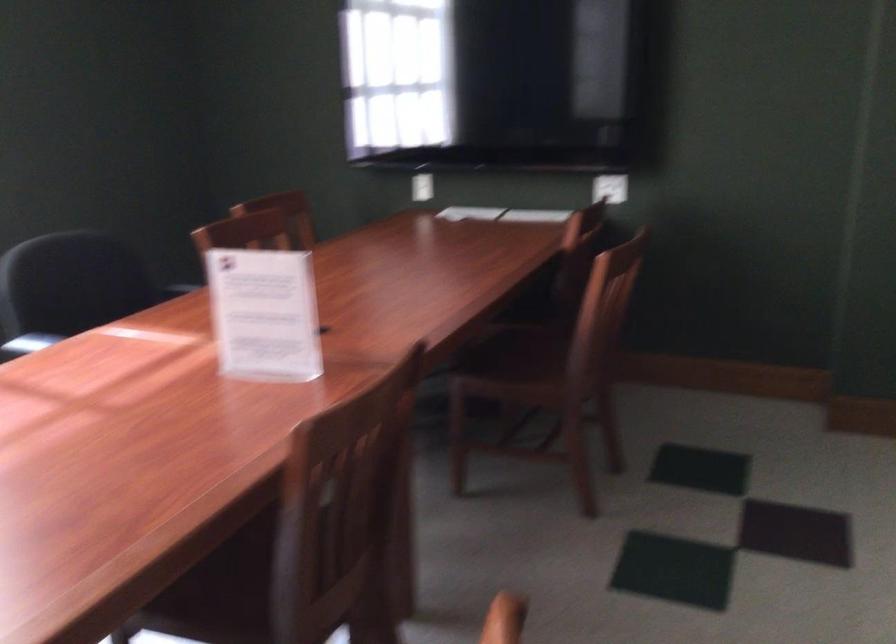
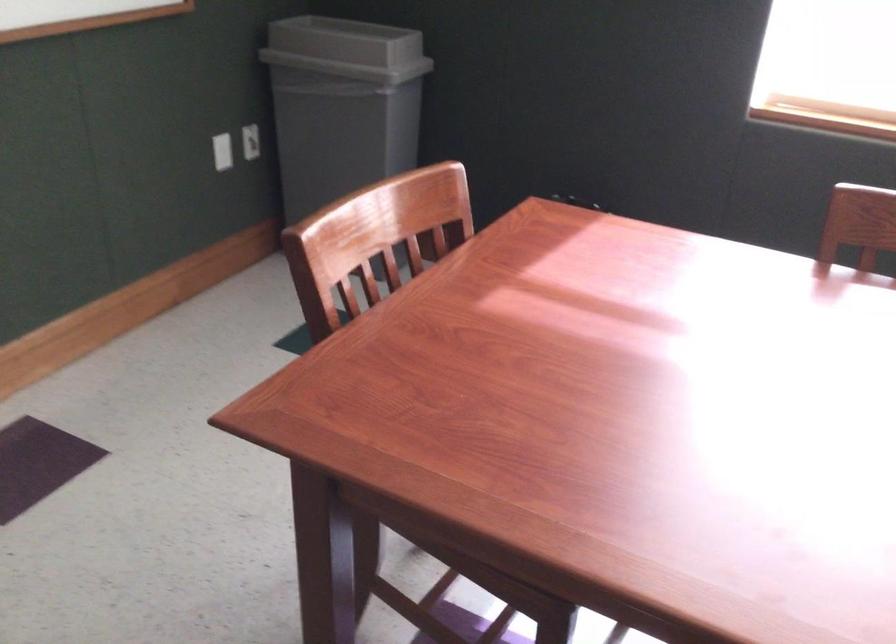
First-person continuous shooting, in which direction is the camera rotating?

The rotation direction of the camera is left-down.